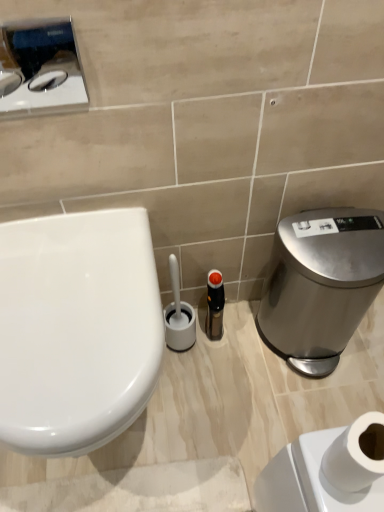
Question: Considering the positions of satin silver trash can at right and white glossy toilet at left in the image, is satin silver trash can at right bigger or smaller than white glossy toilet at left?

Choices:
 (A) small
 (B) big

Answer: (A)

Question: Is point (374, 266) positioned closer to the camera than point (84, 284)?

Choices:
 (A) closer
 (B) farther

Answer: (B)

Question: Which is nearer to the white glossy toilet at left?

Choices:
 (A) black plastic bottle at center
 (B) brushed metal toilet paper dispenser at upper left
 (C) satin silver trash can at right
 (D) white matte toilet paper at lower right

Answer: (B)

Question: Which object is positioned farthest from the white glossy toilet at left?

Choices:
 (A) white matte toilet paper at lower right
 (B) black plastic bottle at center
 (C) brushed metal toilet paper dispenser at upper left
 (D) satin silver trash can at right

Answer: (D)